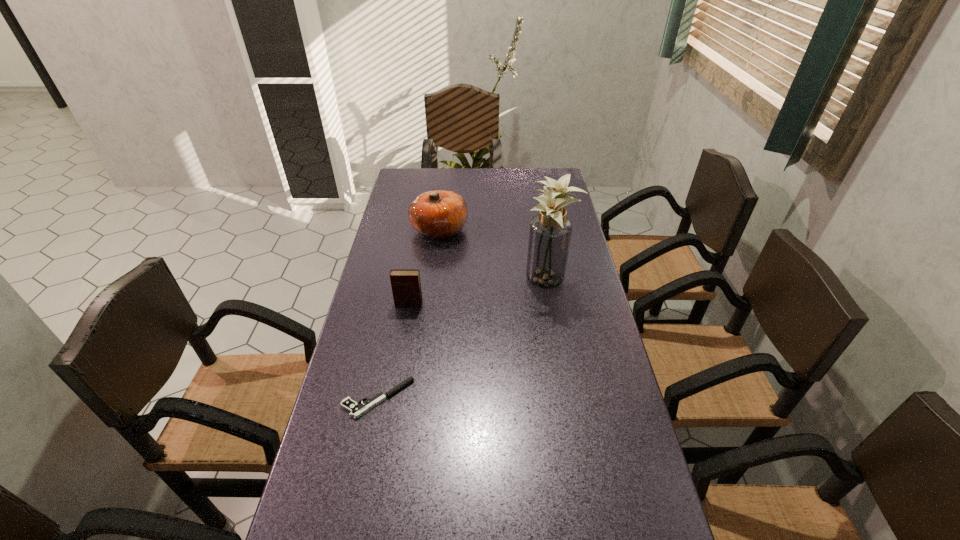
This screenshot has width=960, height=540. Find the location of `empty space that is in between the flower arrangement and the second tallest object`. empty space that is in between the flower arrangement and the second tallest object is located at coordinates click(492, 255).

Identify the location of vacant space that is in between the tallest object and the pumpkin. (492, 255).

Where is `vacant area that lies between the shortest object and the rightmost object`? vacant area that lies between the shortest object and the rightmost object is located at coordinates (462, 340).

Image resolution: width=960 pixels, height=540 pixels. I want to click on vacant area that lies between the rightmost object and the diary, so click(x=477, y=293).

The image size is (960, 540). Find the location of `free space between the second shortest object and the nearest object`. free space between the second shortest object and the nearest object is located at coordinates (x=394, y=352).

This screenshot has height=540, width=960. Identify the location of vacant space that's between the third tallest object and the rightmost object. (477, 293).

The width and height of the screenshot is (960, 540). In order to click on empty space that is in between the third tallest object and the shortest object in this screenshot , I will do `click(394, 352)`.

The height and width of the screenshot is (540, 960). What are the coordinates of `free spot between the flower arrangement and the second shortest object` in the screenshot? It's located at (477, 293).

Where is `vacant area that lies between the farthest object and the tallest object`? The height and width of the screenshot is (540, 960). vacant area that lies between the farthest object and the tallest object is located at coordinates tap(492, 255).

Locate an element on the screen. This screenshot has height=540, width=960. object identified as the second closest to the flower arrangement is located at coordinates (406, 287).